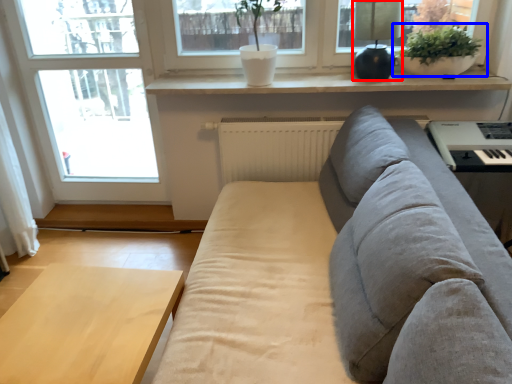
Question: Which object is further to the camera taking this photo, lamp (highlighted by a red box) or houseplant (highlighted by a blue box)?

Choices:
 (A) lamp
 (B) houseplant

Answer: (B)